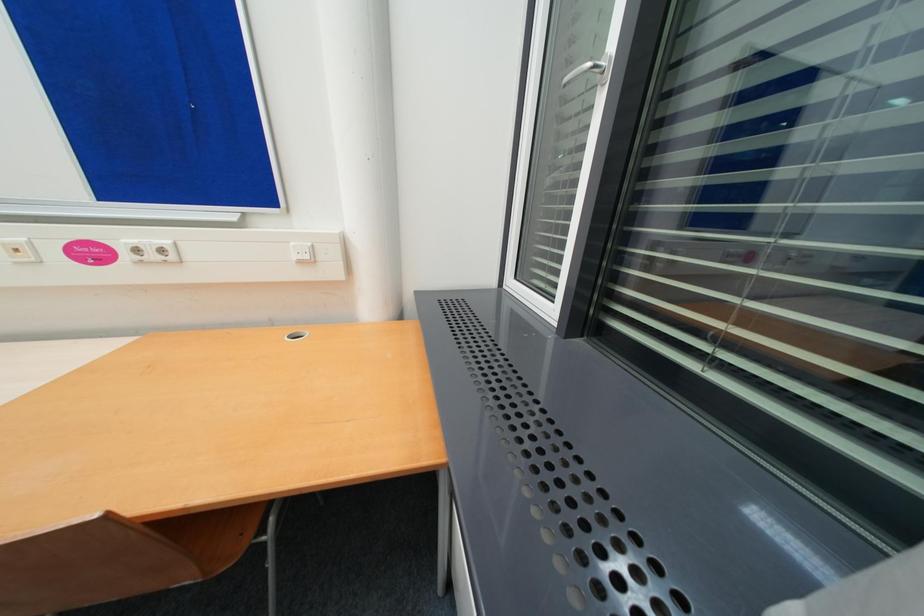
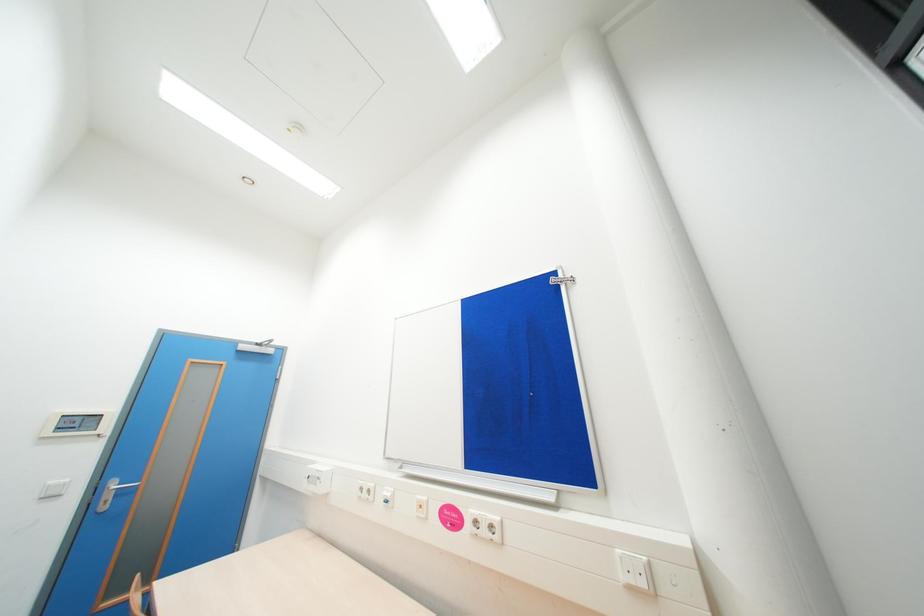
The first image is from the beginning of the video and the second image is from the end. How did the camera likely rotate when shooting the video?

The camera rotated toward left-up.